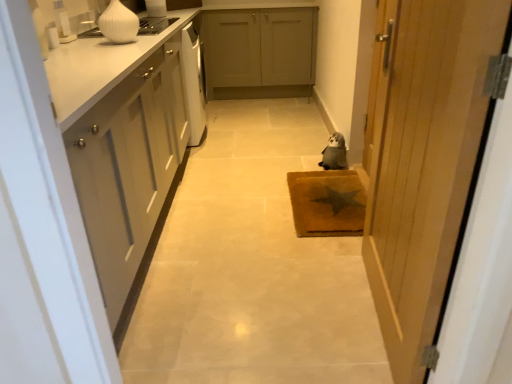
Question: Based on their positions, is fuzzy gray stuffed animal at center located to the left or right of matte gray cabinets at center, positioned as the first cabinetry in right-to-left order?

Choices:
 (A) right
 (B) left

Answer: (A)

Question: In the image, is fuzzy gray stuffed animal at center positioned in front of or behind matte gray cabinets at center, which ranks as the second cabinetry in bottom-to-top order?

Choices:
 (A) behind
 (B) front

Answer: (B)

Question: Considering the real-world distances, which object is farthest from the brown textured mat at center?

Choices:
 (A) matte gray cabinets at center, which ranks as the second cabinetry in bottom-to-top order
 (B) white matte cabinet at left, the 2th cabinetry viewed from the back
 (C) wooden door at right
 (D) white glossy vase at upper left
 (E) fuzzy gray stuffed animal at center

Answer: (A)

Question: Estimate the real-world distances between objects in this image. Which object is closer to the white glossy vase at upper left?

Choices:
 (A) wooden door at right
 (B) brown textured mat at center
 (C) matte gray cabinets at center, which ranks as the second cabinetry in bottom-to-top order
 (D) white matte cabinet at left, the 2th cabinetry when ordered from right to left
 (E) fuzzy gray stuffed animal at center

Answer: (D)